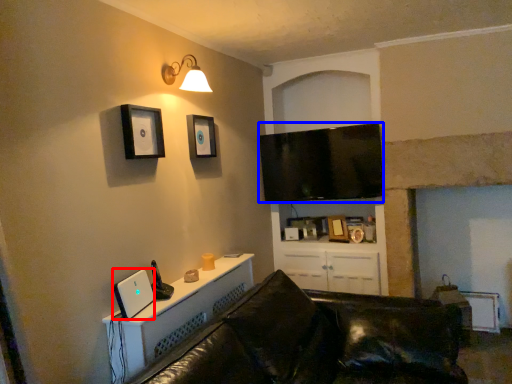
Question: Which object appears closest to the camera in this image, desktop computer (highlighted by a red box) or television (highlighted by a blue box)?

Choices:
 (A) desktop computer
 (B) television

Answer: (A)